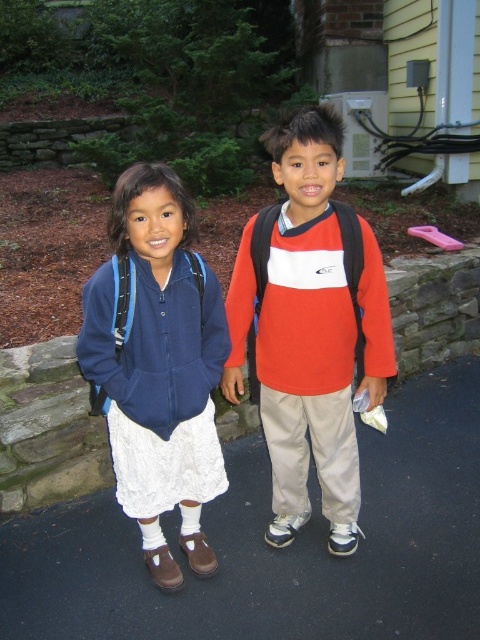
Question: Does black asphalt pavement at lower center lie behind matte blue backpack at left?

Choices:
 (A) no
 (B) yes

Answer: (B)

Question: Observing the image, what is the correct spatial positioning of black asphalt pavement at lower center in reference to matte red sweater at center?

Choices:
 (A) above
 (B) below

Answer: (B)

Question: Which point is closer to the camera taking this photo?

Choices:
 (A) (201, 364)
 (B) (27, 532)

Answer: (A)

Question: Does matte red sweater at center have a larger size compared to matte blue backpack at left?

Choices:
 (A) no
 (B) yes

Answer: (B)

Question: Among these objects, which one is farthest from the camera?

Choices:
 (A) matte red sweater at center
 (B) black asphalt pavement at lower center
 (C) matte blue backpack at left

Answer: (B)

Question: Which object is closer to the camera taking this photo?

Choices:
 (A) matte red sweater at center
 (B) matte blue backpack at left
 (C) black asphalt pavement at lower center

Answer: (B)